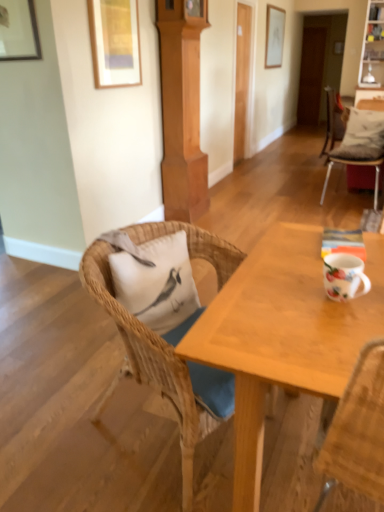
Find the location of `vacant area situated below woven wood chair at center, arranged as the first chair when viewed from the front (from a real-world perspective)`. vacant area situated below woven wood chair at center, arranged as the first chair when viewed from the front (from a real-world perspective) is located at coordinates (177, 447).